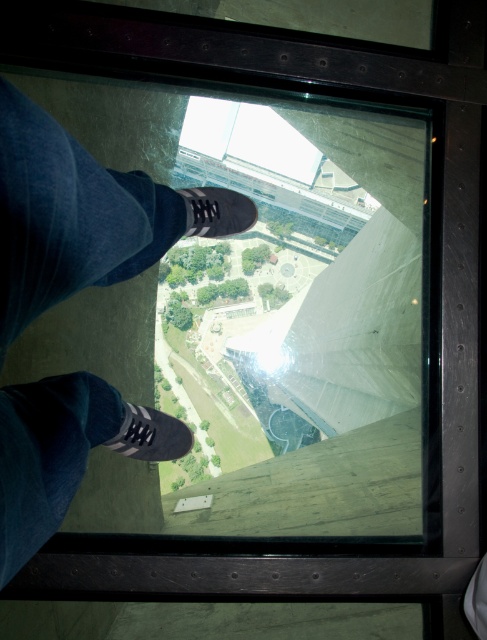
Question: Can you confirm if black suede shoe at lower left is positioned to the right of black suede shoe at center?

Choices:
 (A) no
 (B) yes

Answer: (A)

Question: Which object is the closest to the dark blue jeans at center?

Choices:
 (A) black suede shoe at center
 (B) black suede shoe at lower left

Answer: (B)

Question: Which point appears closest to the camera in this image?

Choices:
 (A) (0, 492)
 (B) (187, 214)

Answer: (A)

Question: Is dark blue jeans at center smaller than black suede shoe at center?

Choices:
 (A) yes
 (B) no

Answer: (B)

Question: Based on their relative distances, which object is nearer to the dark blue jeans at center?

Choices:
 (A) black suede shoe at center
 (B) black suede shoe at lower left

Answer: (B)

Question: From the image, what is the correct spatial relationship of dark blue jeans at center in relation to black suede shoe at lower left?

Choices:
 (A) below
 (B) above

Answer: (B)